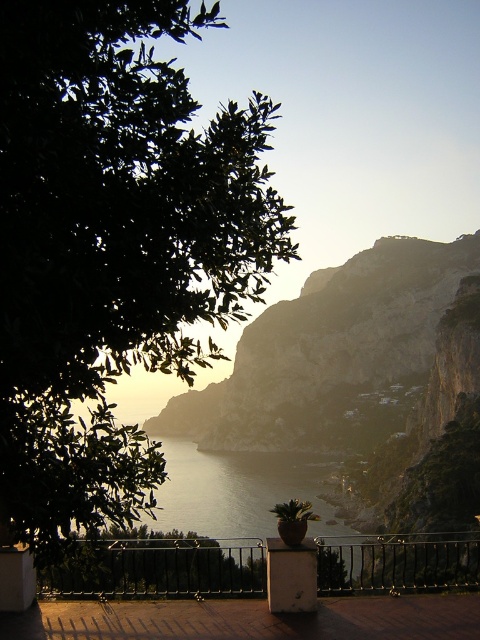
Which is more to the left, green leafy tree at upper left or black metal railing at center?

Positioned to the left is green leafy tree at upper left.

Between point (35, 268) and point (160, 556), which one is positioned in front?

Point (35, 268) is in front.

Identify the location of green leafy tree at upper left. The height and width of the screenshot is (640, 480). (111, 246).

Does rugged stone mountain at center lie in front of black metal railing at center?

No, rugged stone mountain at center is further to the viewer.

Can you confirm if rugged stone mountain at center is positioned above black metal railing at center?

Indeed, rugged stone mountain at center is positioned over black metal railing at center.

Where is `rugged stone mountain at center`? rugged stone mountain at center is located at coordinates (331, 355).

Does green leafy tree at upper left appear on the left side of rugged stone mountain at center?

Yes, green leafy tree at upper left is to the left of rugged stone mountain at center.

What do you see at coordinates (111, 246) in the screenshot? I see `green leafy tree at upper left` at bounding box center [111, 246].

You are a GUI agent. You are given a task and a screenshot of the screen. Output one action in this format:
    pyautogui.click(x=<x>, y=<y>)
    Task: Click on the green leafy tree at upper left
    The image size is (480, 640).
    Given the screenshot: What is the action you would take?
    pos(111,246)